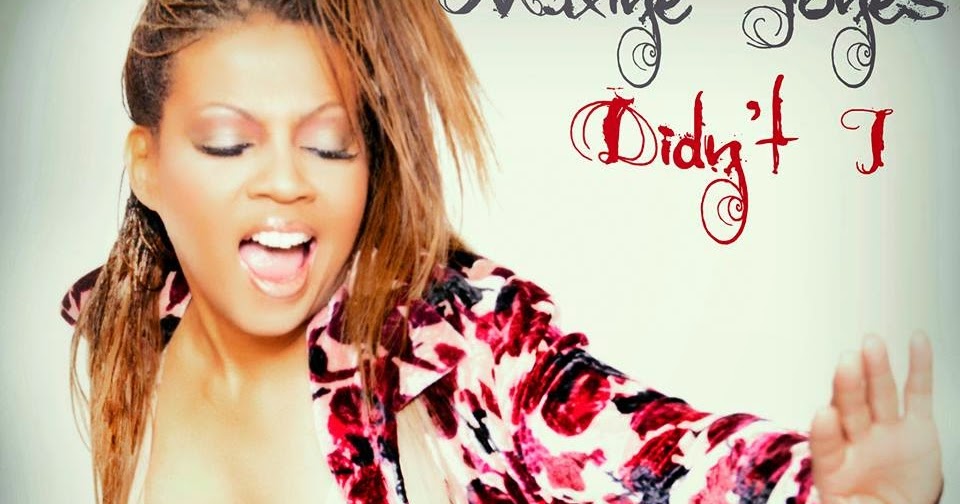
Where is `chest`? Image resolution: width=960 pixels, height=504 pixels. chest is located at coordinates (224, 447).